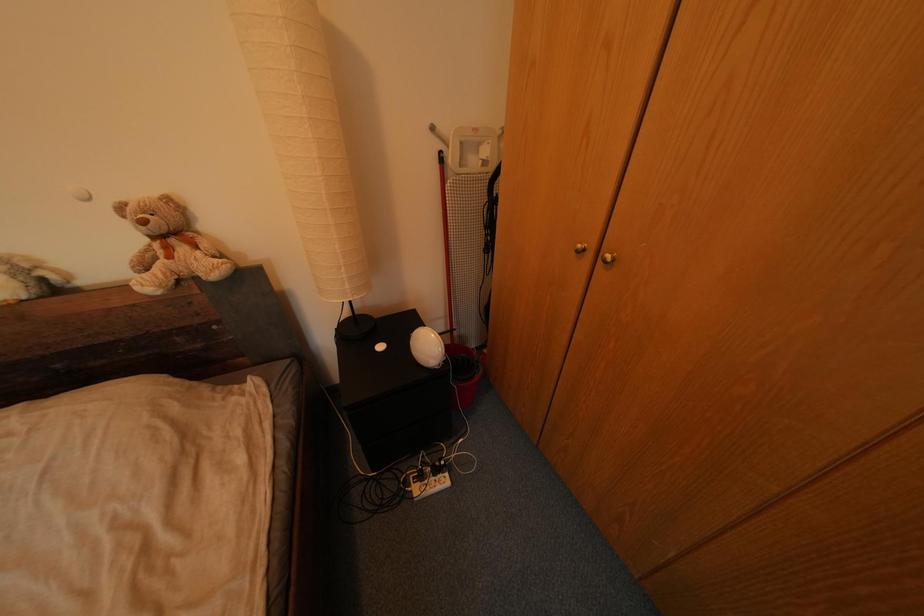
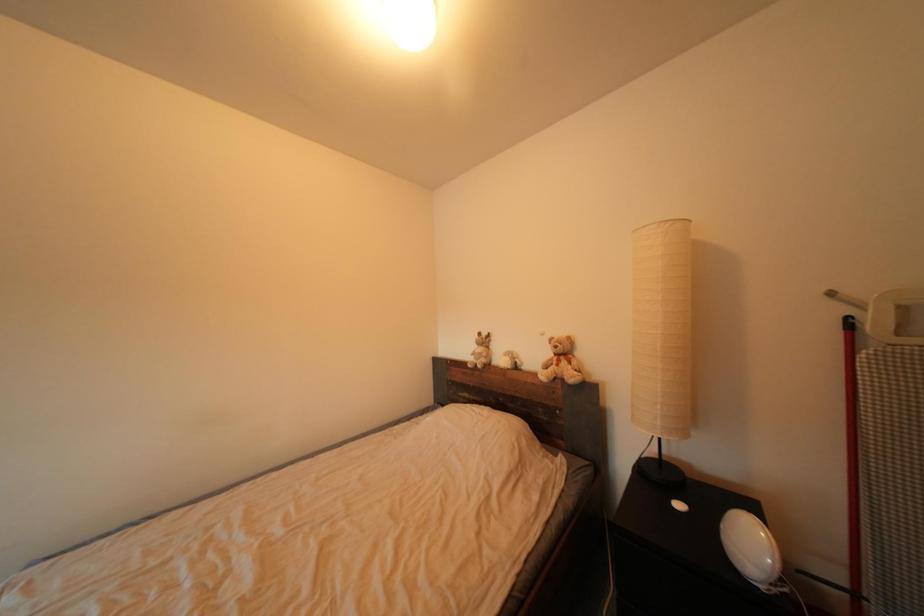
Question: How did the camera likely rotate?

Choices:
 (A) Left
 (B) Right
 (C) Up
 (D) Down

Answer: (A)